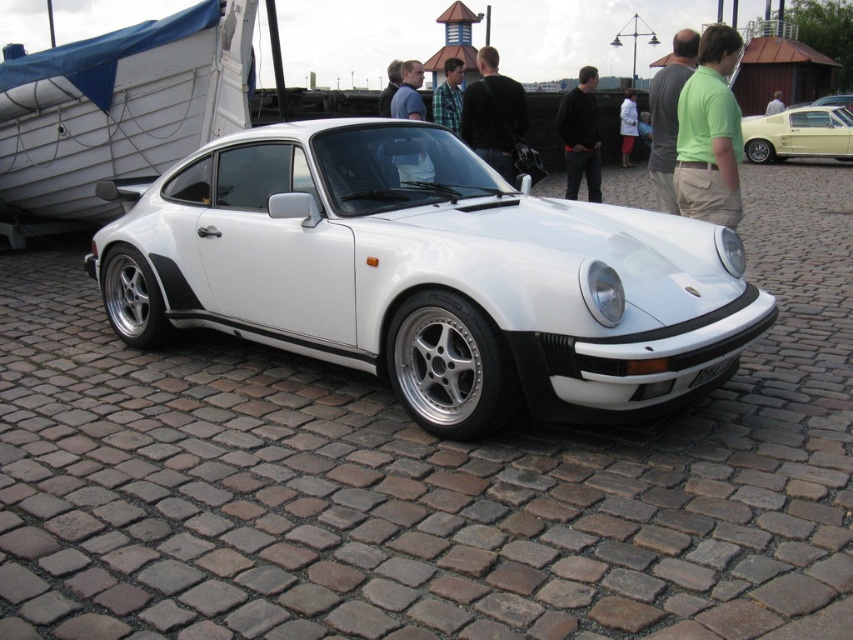
You are planning to take a photo of the white wood boat at left and the matte blue shirt at center. Which object should be positioned closer to the camera to ensure both are fully visible in the frame?

The white wood boat at left might be wider than matte blue shirt at center, so positioning the white wood boat at left closer to the camera would help ensure both fit within the frame.

You are a photographer standing at the back of the white Porsche sports car. You want to take a photo of the light blue shirt at center without the white plastic license plate at center blocking it. Is this possible?

The white plastic license plate at center is in front of the light blue shirt at center, so taking a photo from the back of the white Porsche sports car would have the license plate blocking the view of the light blue shirt at center. You would need to move to a different position where the license plate is not in front of the shirt.